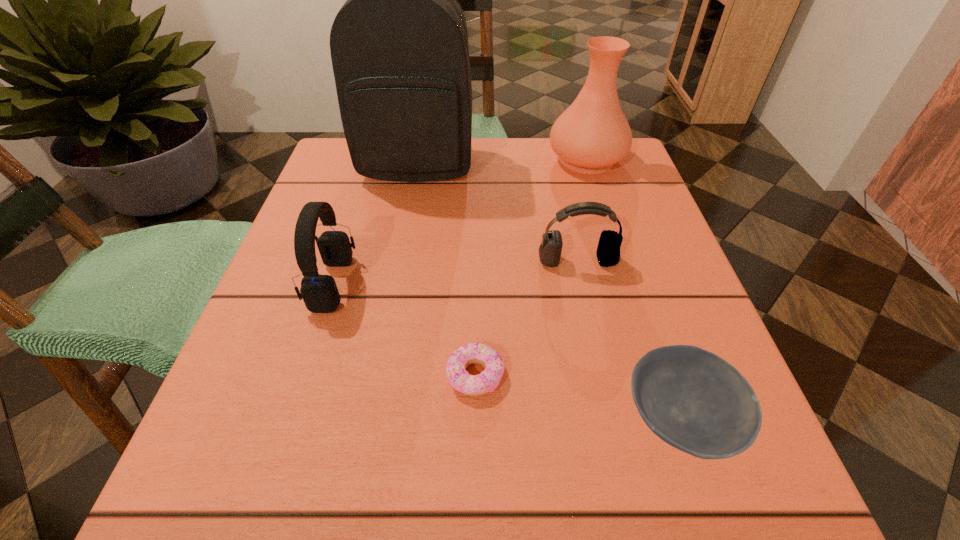
Locate an element on the screen. Image resolution: width=960 pixels, height=540 pixels. object that is the third nearest to the fifth shortest object is located at coordinates (320, 294).

Find the location of a particular element. This screenshot has height=540, width=960. object that ranks as the third closest to the left headset is located at coordinates (608, 251).

I want to click on vacant region that satisfies the following two spatial constraints: 1. on the front-facing side of the backpack; 2. on the headband of the taller headset, so (396, 284).

The width and height of the screenshot is (960, 540). I want to click on vacant point that satisfies the following two spatial constraints: 1. on the headband of the shorter headset; 2. on the headband of the left headset, so click(583, 284).

Where is `free space that satisfies the following two spatial constraints: 1. on the front-facing side of the backpack; 2. on the left side of the shortest object`? The image size is (960, 540). free space that satisfies the following two spatial constraints: 1. on the front-facing side of the backpack; 2. on the left side of the shortest object is located at coordinates (379, 375).

The image size is (960, 540). What are the coordinates of `free space that satisfies the following two spatial constraints: 1. on the front-facing side of the backpack; 2. on the left side of the bowl` in the screenshot? It's located at (371, 420).

In order to click on free point that satisfies the following two spatial constraints: 1. on the headband of the third shortest object; 2. on the headband of the left headset in this screenshot , I will do `click(583, 284)`.

Where is `free location that satisfies the following two spatial constraints: 1. on the headband of the second shortest object; 2. on the right side of the left headset`? free location that satisfies the following two spatial constraints: 1. on the headband of the second shortest object; 2. on the right side of the left headset is located at coordinates (290, 420).

This screenshot has height=540, width=960. Identify the location of free space that satisfies the following two spatial constraints: 1. on the front side of the fifth shortest object; 2. on the right side of the bowl. tap(668, 420).

Where is `free space in the image that satisfies the following two spatial constraints: 1. on the front-facing side of the tallest object; 2. on the left side of the shortest object`? This screenshot has height=540, width=960. free space in the image that satisfies the following two spatial constraints: 1. on the front-facing side of the tallest object; 2. on the left side of the shortest object is located at coordinates (379, 375).